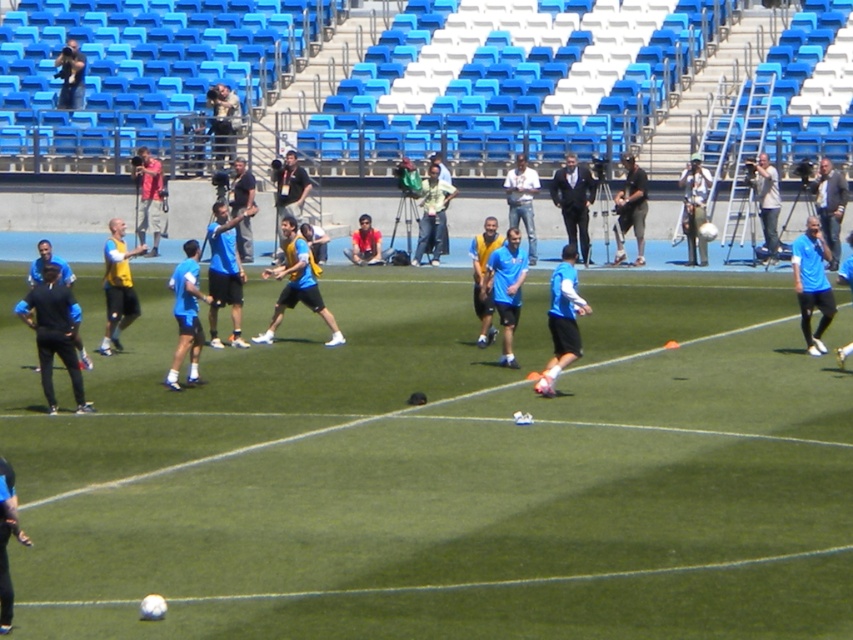
Is point (177, 387) closer to viewer compared to point (694, 163)?

Yes, point (177, 387) is closer to viewer.

Based on the photo, who is taller, matte blue shorts at center or blue fabric camera at upper right?

With more height is blue fabric camera at upper right.

Is point (170, 371) positioned after point (705, 193)?

No, (170, 371) is closer to viewer.

You are a GUI agent. You are given a task and a screenshot of the screen. Output one action in this format:
    pyautogui.click(x=<x>, y=<y>)
    Task: Click on the matte blue shorts at center
    
    Given the screenshot: What is the action you would take?
    pyautogui.click(x=186, y=316)

Describe the element at coordinates (561, 321) in the screenshot. I see `matte blue shirt at center` at that location.

Is matte blue shirt at center wider than blue matte shirt at center?

Yes, matte blue shirt at center is wider than blue matte shirt at center.

Measure the distance between point [566,362] and camera.

A distance of 15.96 meters exists between point [566,362] and camera.

Find the location of a particular element. The image size is (853, 640). matte blue shirt at center is located at coordinates (561, 321).

Between point (270, 330) and point (193, 296), which one is positioned in front?

Point (193, 296) is more forward.

Does point (289, 225) come behind point (194, 360)?

Yes, it is.

Describe the element at coordinates (297, 284) in the screenshot. I see `blue matte jersey at center` at that location.

Where is `blue matte jersey at center`? blue matte jersey at center is located at coordinates (297, 284).